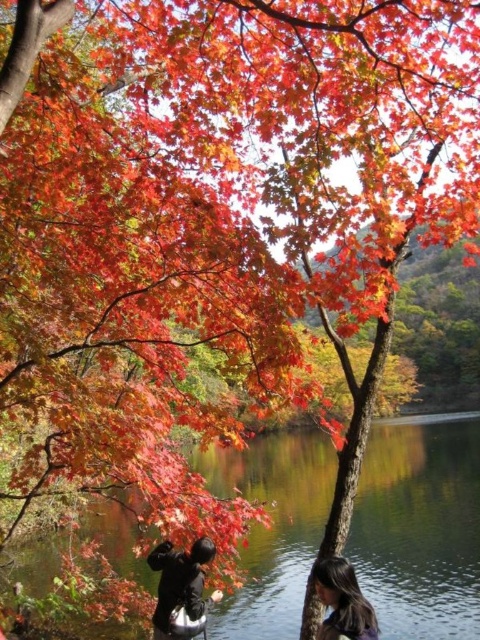
Question: Which object is farther from the camera taking this photo?

Choices:
 (A) black matte jacket at lower center
 (B) smooth brown hair at lower right
 (C) clear water at center

Answer: (C)

Question: Among these objects, which one is nearest to the camera?

Choices:
 (A) clear water at center
 (B) smooth brown hair at lower right
 (C) black matte jacket at lower center

Answer: (B)

Question: Does black matte jacket at lower center have a larger size compared to smooth brown hair at lower right?

Choices:
 (A) no
 (B) yes

Answer: (B)

Question: Considering the real-world distances, which object is farthest from the smooth brown hair at lower right?

Choices:
 (A) black matte jacket at lower center
 (B) clear water at center

Answer: (B)

Question: Where is clear water at center located in relation to black matte jacket at lower center in the image?

Choices:
 (A) above
 (B) below

Answer: (B)

Question: Considering the relative positions of clear water at center and black matte jacket at lower center in the image provided, where is clear water at center located with respect to black matte jacket at lower center?

Choices:
 (A) above
 (B) below

Answer: (B)